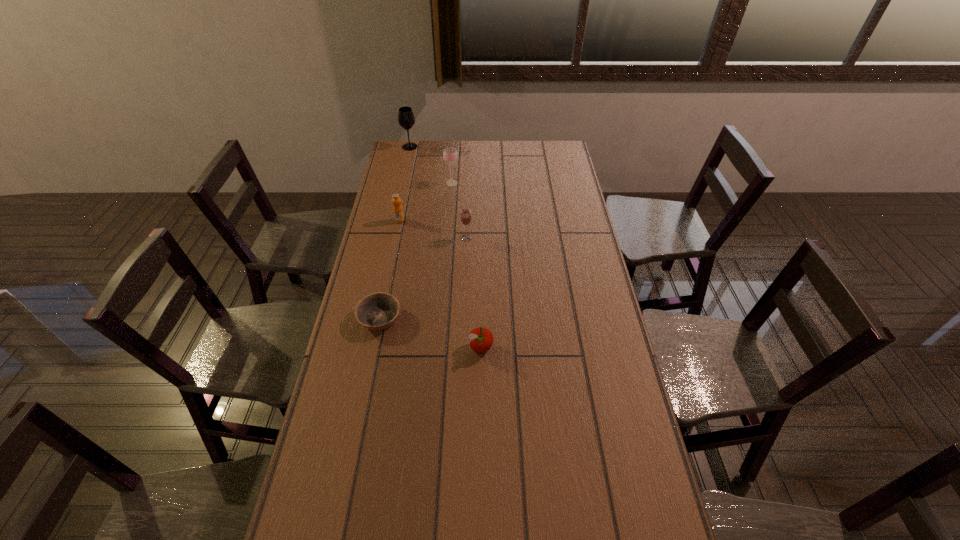
You are a GUI agent. You are given a task and a screenshot of the screen. Output one action in this format:
    pyautogui.click(x=<x>, y=<y>)
    Task: Click on the bowl that is at the left edge
    This screenshot has height=540, width=960.
    Given the screenshot: What is the action you would take?
    pyautogui.click(x=378, y=311)

Find the location of a particular element. object located at the far left corner is located at coordinates (406, 119).

The height and width of the screenshot is (540, 960). In the image, there is a desktop. Find the location of `free space at the far edge`. free space at the far edge is located at coordinates (528, 156).

Find the location of a particular element. This screenshot has width=960, height=540. free spot at the left edge of the desktop is located at coordinates pyautogui.click(x=416, y=204).

In the image, there is a desktop. At what (x,y) coordinates should I click in order to perform the action: click on vacant space at the right edge. Please return your answer as a coordinate pair (x, y). Image resolution: width=960 pixels, height=540 pixels. Looking at the image, I should click on (599, 311).

Identify the location of vacant space at the far right corner of the desktop. This screenshot has height=540, width=960. (538, 156).

Where is `empty space between the shortest object and the orange juice`? empty space between the shortest object and the orange juice is located at coordinates (390, 269).

This screenshot has width=960, height=540. I want to click on free space between the orange juice and the third nearest object, so click(x=433, y=230).

The width and height of the screenshot is (960, 540). Identify the location of vacant area that lies between the third object from right to left and the farthest wineglass. coord(431,165).

Where is `blank region between the second farthest wineglass and the nearest wineglass`? The image size is (960, 540). blank region between the second farthest wineglass and the nearest wineglass is located at coordinates (459, 211).